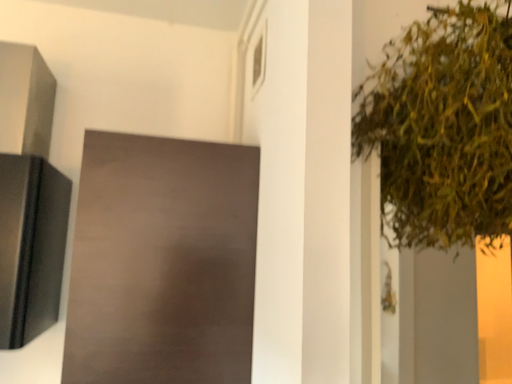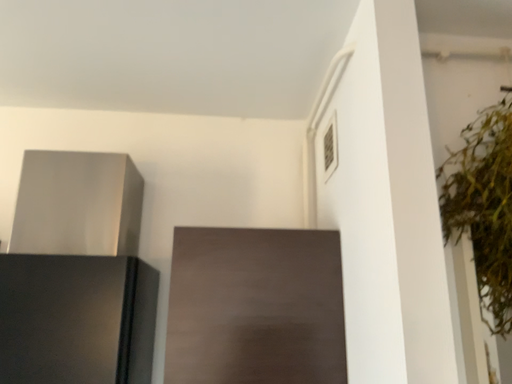
Question: Which way did the camera rotate in the video?

Choices:
 (A) rotated downward
 (B) rotated upward

Answer: (B)